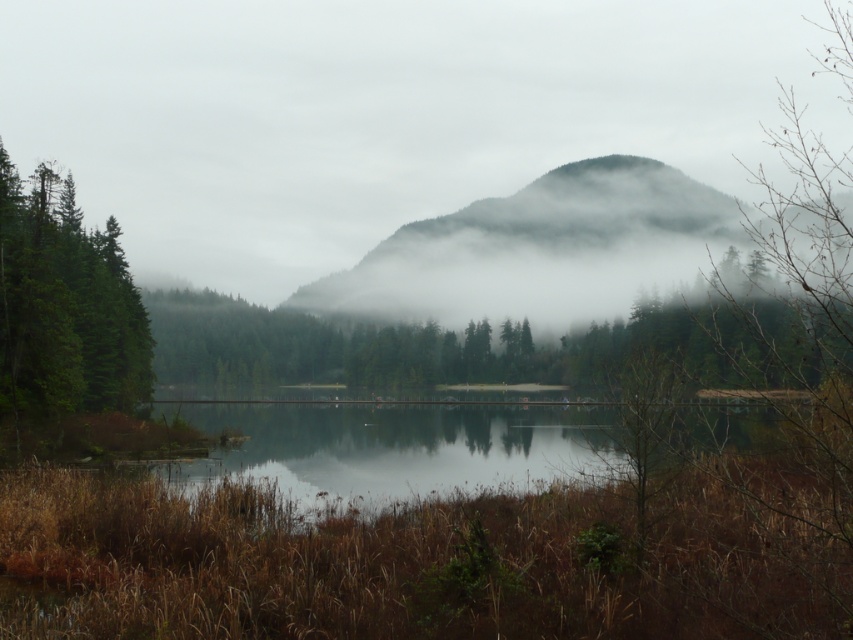
Can you confirm if foggy misty mountain at center is positioned above green matte tree at left?

Yes.

Can you confirm if foggy misty mountain at center is positioned to the left of green matte tree at left?

Correct, you'll find foggy misty mountain at center to the left of green matte tree at left.

Where is `foggy misty mountain at center`? foggy misty mountain at center is located at coordinates (397, 134).

At what (x,y) coordinates should I click in order to perform the action: click on foggy misty mountain at center. Please return your answer as a coordinate pair (x, y). Image resolution: width=853 pixels, height=640 pixels. Looking at the image, I should click on (397, 134).

Can you confirm if foggy forested mountain at center is wider than green matte tree at left?

Yes.

Does foggy forested mountain at center appear on the left side of green matte tree at left?

No, foggy forested mountain at center is not to the left of green matte tree at left.

Where is `foggy forested mountain at center`? The height and width of the screenshot is (640, 853). foggy forested mountain at center is located at coordinates pyautogui.click(x=541, y=250).

Does foggy misty mountain at center have a greater width compared to foggy forested mountain at center?

Yes, foggy misty mountain at center is wider than foggy forested mountain at center.

Can you confirm if foggy misty mountain at center is smaller than foggy forested mountain at center?

Incorrect, foggy misty mountain at center is not smaller in size than foggy forested mountain at center.

The width and height of the screenshot is (853, 640). What do you see at coordinates (397, 134) in the screenshot?
I see `foggy misty mountain at center` at bounding box center [397, 134].

Identify the location of foggy misty mountain at center. The width and height of the screenshot is (853, 640). (397, 134).